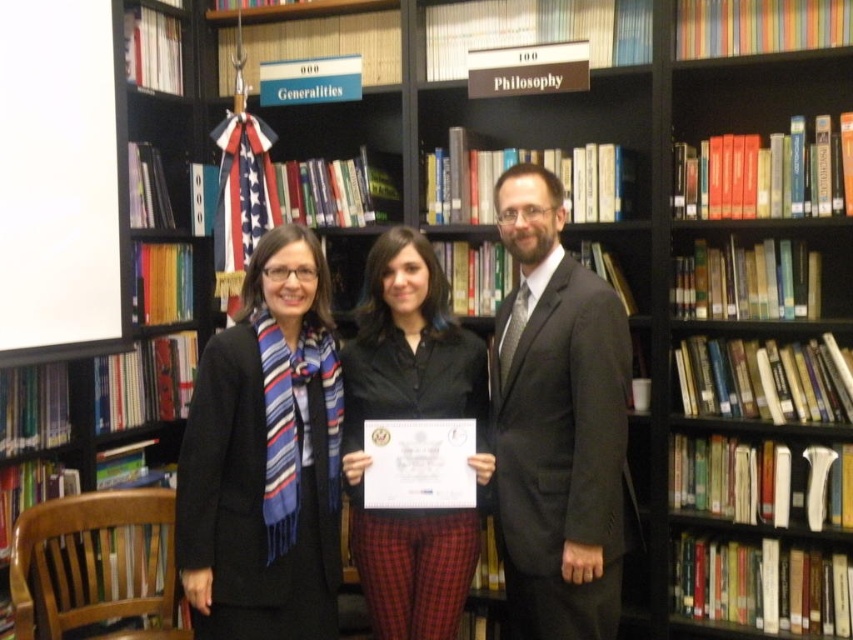
Question: In this image, where is blue striped scarf at center located relative to dark gray suit at center?

Choices:
 (A) below
 (B) above

Answer: (A)

Question: Which point is farther to the camera?

Choices:
 (A) black matte shirt at center
 (B) dark gray suit at center

Answer: (A)

Question: Where is blue striped scarf at center located in relation to black matte shirt at center in the image?

Choices:
 (A) above
 (B) below

Answer: (A)

Question: Does blue striped scarf at center appear on the right side of black matte shirt at center?

Choices:
 (A) no
 (B) yes

Answer: (A)

Question: Which point is closer to the camera?

Choices:
 (A) (395, 401)
 (B) (277, 456)
 (C) (576, 433)

Answer: (B)

Question: Which of these objects is positioned closest to the blue striped scarf at center?

Choices:
 (A) dark gray suit at center
 (B) black matte shirt at center

Answer: (B)